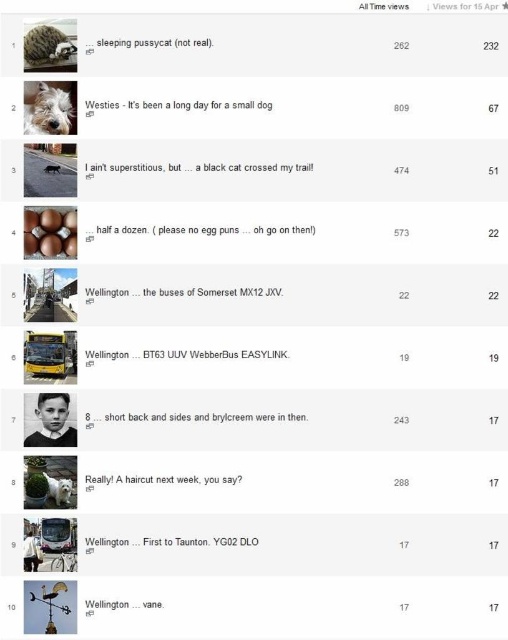
Question: Is fluffy white dog at upper left in front of fluffy brown hedgehog at upper left?

Choices:
 (A) no
 (B) yes

Answer: (A)

Question: Estimate the real-world distances between objects in this image. Which object is farther from the fluffy brown hedgehog at upper left?

Choices:
 (A) white fluffy dog at lower left
 (B) fluffy white dog at upper left

Answer: (A)

Question: Which object is farther from the camera taking this photo?

Choices:
 (A) white fluffy dog at lower left
 (B) fluffy brown hedgehog at upper left
 (C) fluffy white dog at upper left

Answer: (A)

Question: Does fluffy white dog at upper left appear on the left side of white fluffy dog at lower left?

Choices:
 (A) yes
 (B) no

Answer: (A)

Question: In this image, where is fluffy white dog at upper left located relative to fluffy brown hedgehog at upper left?

Choices:
 (A) left
 (B) right

Answer: (A)

Question: Among these points, which one is nearest to the camera?

Choices:
 (A) (70, 477)
 (B) (51, 104)
 (C) (26, 51)

Answer: (C)